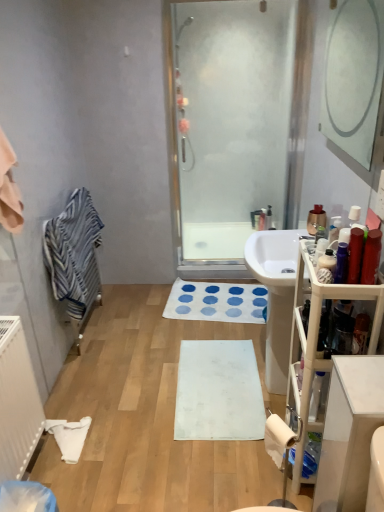
Where is `blank space situated above white glossy cabinet at right (from a real-world perspective)`? This screenshot has width=384, height=512. blank space situated above white glossy cabinet at right (from a real-world perspective) is located at coordinates (365, 376).